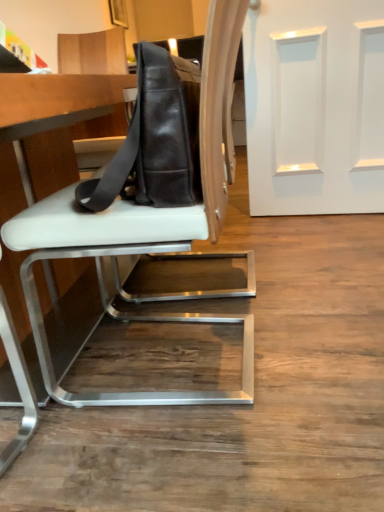
You are a GUI agent. You are given a task and a screenshot of the screen. Output one action in this format:
    pyautogui.click(x=<x>, y=<y>)
    Task: Click on the vacant area that lies to the right of white leather chair at center
    Image resolution: width=384 pixels, height=512 pixels.
    Given the screenshot: What is the action you would take?
    pyautogui.click(x=321, y=332)